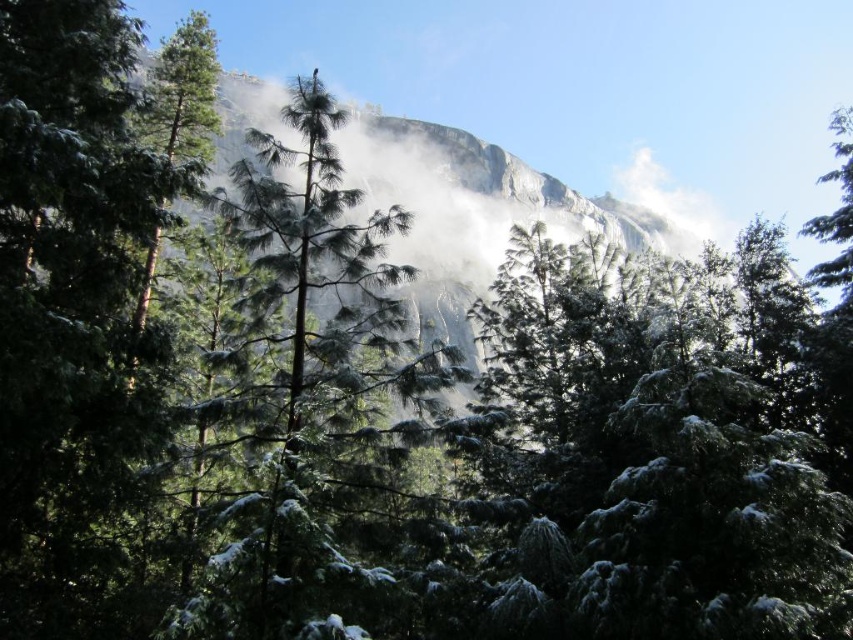
Question: Where is green matte tree at center located in relation to white fluffy cloud at upper center in the image?

Choices:
 (A) above
 (B) below

Answer: (B)

Question: Among these objects, which one is nearest to the camera?

Choices:
 (A) white fluffy cloud at upper center
 (B) rocky cliff at center

Answer: (B)

Question: Among these points, which one is farthest from the camera?

Choices:
 (A) tap(430, 129)
 (B) tap(339, 554)

Answer: (A)

Question: In this image, where is green matte tree at center located relative to white fluffy cloud at upper center?

Choices:
 (A) below
 (B) above

Answer: (A)

Question: Among these points, which one is nearest to the camera?

Choices:
 (A) (337, 132)
 (B) (340, 292)

Answer: (B)

Question: Observing the image, what is the correct spatial positioning of green matte tree at center in reference to rocky cliff at center?

Choices:
 (A) left
 (B) right

Answer: (A)